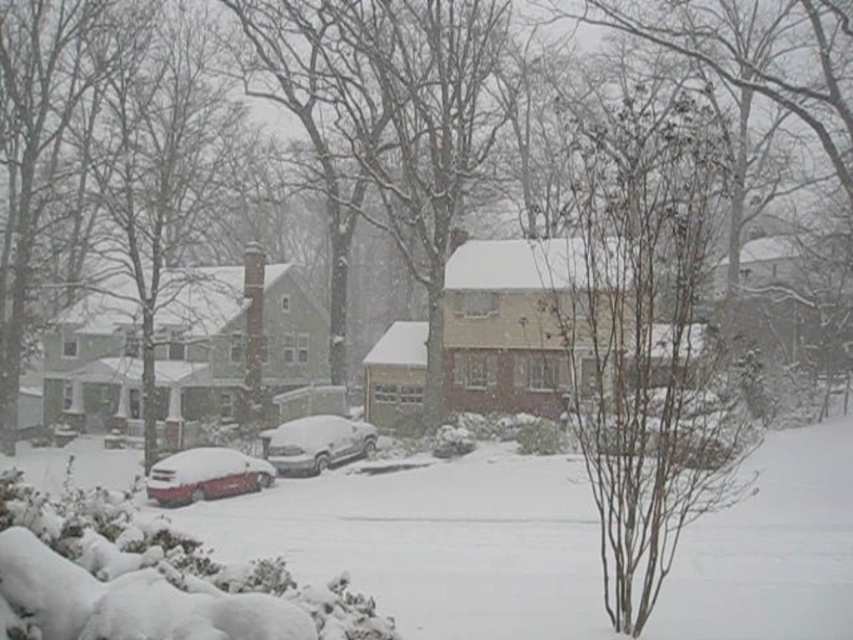
Question: Which is farther from the sleek metallic car at lower left?

Choices:
 (A) white fluffy snow at center
 (B) bare branches at center
 (C) sleek silver sedan at center

Answer: (B)

Question: Is white fluffy snow at center positioned behind sleek metallic car at lower left?

Choices:
 (A) yes
 (B) no

Answer: (B)

Question: Which is nearer to the sleek silver sedan at center?

Choices:
 (A) sleek metallic car at lower left
 (B) white fluffy snow at center
 (C) bare branches at center

Answer: (A)

Question: Which object appears closest to the camera in this image?

Choices:
 (A) sleek silver sedan at center
 (B) white fluffy snow at center
 (C) sleek metallic car at lower left

Answer: (B)

Question: Can you confirm if white fluffy snow at center is wider than bare branches at center?

Choices:
 (A) yes
 (B) no

Answer: (A)

Question: Can you confirm if white fluffy snow at center is positioned below sleek metallic car at lower left?

Choices:
 (A) yes
 (B) no

Answer: (B)